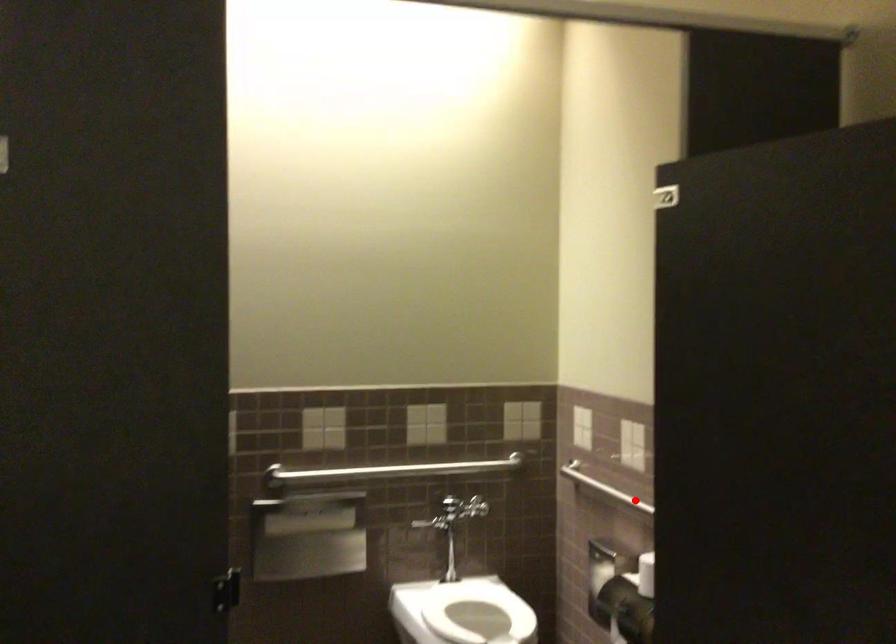
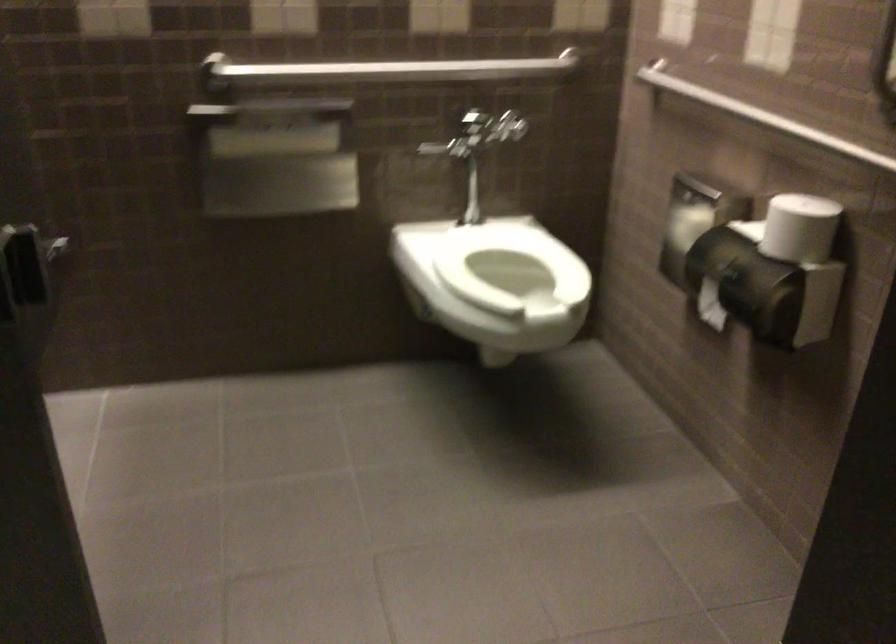
Question: I am providing you with two images of the same scene from different viewpoints. Image1 has a red point marked. In image2, the corresponding 3D location appears at what relative position? Reply with the corresponding letter.

Choices:
 (A) Closer
 (B) Farther

Answer: (A)